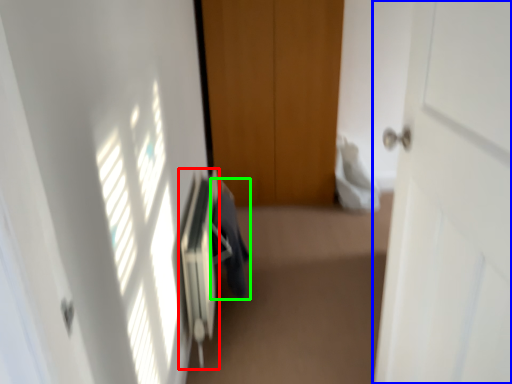
Question: Considering the real-world distances, which object is farthest from radiator (highlighted by a red box)? door (highlighted by a blue box) or laundry (highlighted by a green box)?

Choices:
 (A) door
 (B) laundry

Answer: (A)